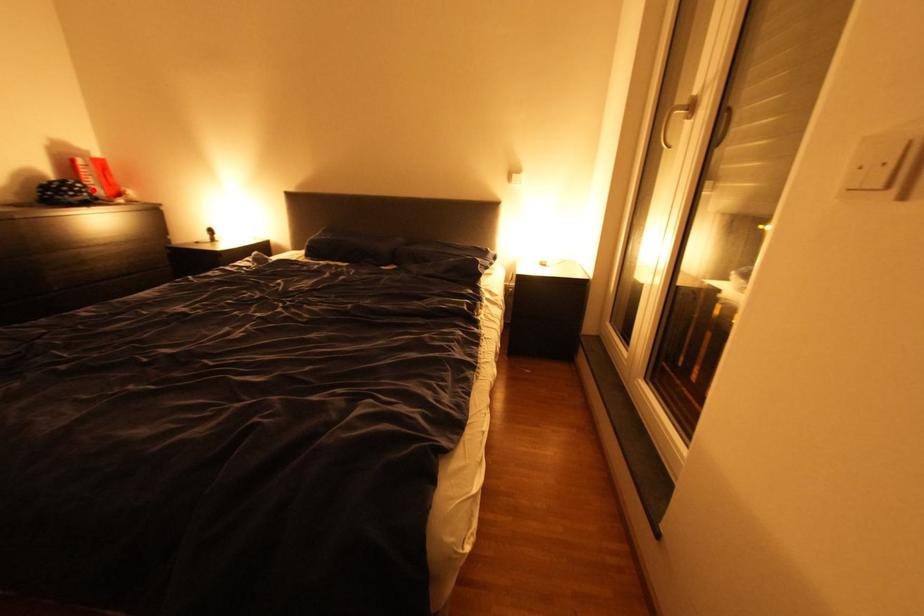
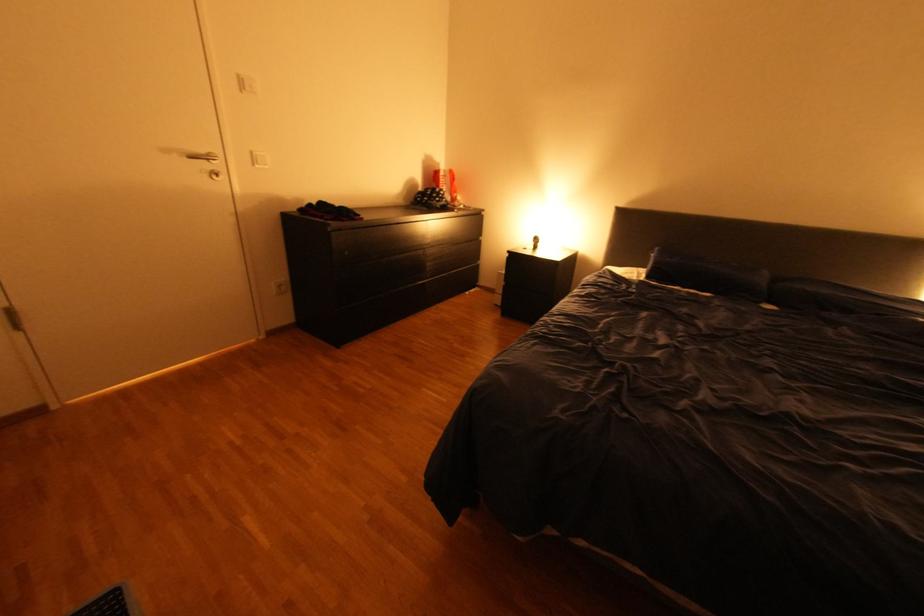
Locate, in the second image, the point that corresponds to the highlighted location in the first image.

(454, 196)